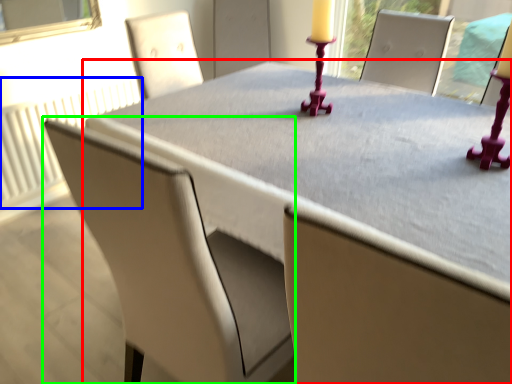
Question: Estimate the real-world distances between objects in this image. Which object is closer to table (highlighted by a red box), radiator (highlighted by a blue box) or chair (highlighted by a green box)?

Choices:
 (A) radiator
 (B) chair

Answer: (B)